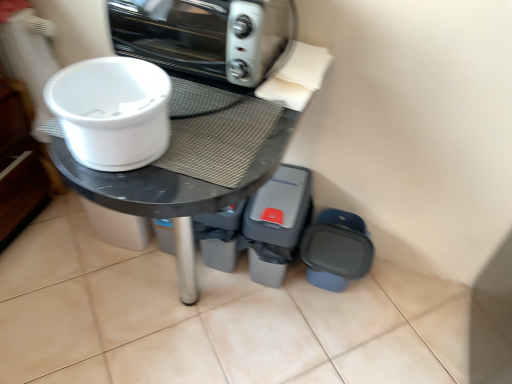
Measure the distance between gray plastic bin at lower right, which appears as the first appliance when viewed from the left, and camera.

gray plastic bin at lower right, which appears as the first appliance when viewed from the left, and camera are 4.07 feet apart.

Identify the location of matte plastic container at lower right, the first appliance from the right. (336, 250).

Where is `gray plastic bin at lower right, the second appliance viewed from the right`? The height and width of the screenshot is (384, 512). gray plastic bin at lower right, the second appliance viewed from the right is located at coordinates (276, 223).

Considering the sizes of objects matte plastic container at lower right, the second appliance viewed from the left, and metallic silver toaster oven at upper center in the image provided, who is shorter, matte plastic container at lower right, the second appliance viewed from the left, or metallic silver toaster oven at upper center?

With less height is metallic silver toaster oven at upper center.

How different are the orientations of matte plastic container at lower right, the first appliance from the right, and metallic silver toaster oven at upper center in degrees?

The angular difference between matte plastic container at lower right, the first appliance from the right, and metallic silver toaster oven at upper center is 2.81 degrees.

Could you tell me if matte plastic container at lower right, the first appliance from the right, is turned towards metallic silver toaster oven at upper center?

No.

The height and width of the screenshot is (384, 512). There is a metallic silver toaster oven at upper center. Identify the location of the 2nd appliance below it (from a real-world perspective). (336, 250).

Is white plastic bowl at upper left oriented away from matte black table at center?

No, matte black table at center is not at the back of white plastic bowl at upper left.

Is there a large distance between white plastic bowl at upper left and matte black table at center?

Actually, white plastic bowl at upper left and matte black table at center are a little close together.

Identify the location of toilet bowl above the matte black table at center (from the image's perspective). This screenshot has height=384, width=512. (112, 112).

From the image's perspective, which is above, white plastic bowl at upper left or matte black table at center?

white plastic bowl at upper left, from the image's perspective.

From a real-world perspective, who is located lower, gray plastic bin at lower right, which appears as the first appliance when viewed from the left, or white plastic bowl at upper left?

gray plastic bin at lower right, which appears as the first appliance when viewed from the left.

Which is in front, point (307, 202) or point (122, 119)?

Positioned in front is point (122, 119).

Can you confirm if gray plastic bin at lower right, the second appliance viewed from the right, is thinner than white plastic bowl at upper left?

No.

You are a GUI agent. You are given a task and a screenshot of the screen. Output one action in this format:
    pyautogui.click(x=<x>, y=<y>)
    Task: Click on the 1st appliance behind the white plastic bowl at upper left, starting your count from the anchor
    
    Given the screenshot: What is the action you would take?
    pyautogui.click(x=276, y=223)

In the scene shown: Is metallic silver toaster oven at upper center beside matte black table at center?

No, metallic silver toaster oven at upper center is not making contact with matte black table at center.

Is point (266, 67) positioned in front of point (69, 181)?

No, (266, 67) is behind (69, 181).

Where is `round table to the left of metallic silver toaster oven at upper center`? Image resolution: width=512 pixels, height=384 pixels. round table to the left of metallic silver toaster oven at upper center is located at coordinates (192, 172).

Is metallic silver toaster oven at upper center positioned with its back to matte black table at center?

No, metallic silver toaster oven at upper center is not facing the opposite direction of matte black table at center.

Does matte black table at center have a smaller size compared to gray plastic bin at lower right, the second appliance viewed from the right?

Incorrect, matte black table at center is not smaller in size than gray plastic bin at lower right, the second appliance viewed from the right.

Which of these two, matte black table at center or gray plastic bin at lower right, which appears as the first appliance when viewed from the left, is wider?

matte black table at center is wider.

Looking at this image, is matte black table at center to the left of gray plastic bin at lower right, which appears as the first appliance when viewed from the left, from the viewer's perspective?

Correct, you'll find matte black table at center to the left of gray plastic bin at lower right, which appears as the first appliance when viewed from the left.

Is gray plastic bin at lower right, the second appliance viewed from the right, with matte plastic container at lower right, the second appliance viewed from the left?

There is a gap between gray plastic bin at lower right, the second appliance viewed from the right, and matte plastic container at lower right, the second appliance viewed from the left.

Based on the photo, measure the distance from gray plastic bin at lower right, the second appliance viewed from the right, to matte plastic container at lower right, the first appliance from the right.

A distance of 6.51 inches exists between gray plastic bin at lower right, the second appliance viewed from the right, and matte plastic container at lower right, the first appliance from the right.

Is gray plastic bin at lower right, which appears as the first appliance when viewed from the left, spatially inside matte plastic container at lower right, the second appliance viewed from the left, or outside of it?

gray plastic bin at lower right, which appears as the first appliance when viewed from the left, lies outside matte plastic container at lower right, the second appliance viewed from the left.

Which is behind, point (295, 199) or point (322, 211)?

The point (322, 211) is behind.

Between matte black table at center and white plastic bowl at upper left, which one has more height?

matte black table at center.

Find the location of a particular element. The width and height of the screenshot is (512, 384). toilet bowl above the matte black table at center (from a real-world perspective) is located at coordinates (112, 112).

Is matte black table at center oriented away from white plastic bowl at upper left?

No.

From the image's perspective, is matte black table at center positioned above or below white plastic bowl at upper left?

Based on their image positions, matte black table at center is located beneath white plastic bowl at upper left.

Find the location of `kitchen appliance above the matte plastic container at lower right, the first appliance from the right (from a real-world perspective)`. kitchen appliance above the matte plastic container at lower right, the first appliance from the right (from a real-world perspective) is located at coordinates (205, 35).

Locate an element on the screen. The height and width of the screenshot is (384, 512). round table below the white plastic bowl at upper left (from the image's perspective) is located at coordinates (192, 172).

Which object lies nearer to the anchor point matte black table at center, white plastic bowl at upper left or gray plastic bin at lower right, which appears as the first appliance when viewed from the left?

white plastic bowl at upper left is closer to matte black table at center.

Considering their positions, is gray plastic bin at lower right, the second appliance viewed from the right, positioned further to white plastic bowl at upper left than matte plastic container at lower right, the first appliance from the right?

Among the two, matte plastic container at lower right, the first appliance from the right, is located further to white plastic bowl at upper left.

Which object lies further to the anchor point gray plastic bin at lower right, which appears as the first appliance when viewed from the left, metallic silver toaster oven at upper center or matte plastic container at lower right, the first appliance from the right?

Based on the image, metallic silver toaster oven at upper center appears to be further to gray plastic bin at lower right, which appears as the first appliance when viewed from the left.

Considering their positions, is matte plastic container at lower right, the second appliance viewed from the left, positioned further to gray plastic bin at lower right, the second appliance viewed from the right, than matte black table at center?

Among the two, matte black table at center is located further to gray plastic bin at lower right, the second appliance viewed from the right.

Based on their spatial positions, is matte black table at center or metallic silver toaster oven at upper center further from gray plastic bin at lower right, the second appliance viewed from the right?

metallic silver toaster oven at upper center.

Looking at the image, which one is located further to metallic silver toaster oven at upper center, gray plastic bin at lower right, which appears as the first appliance when viewed from the left, or matte plastic container at lower right, the first appliance from the right?

Among the two, matte plastic container at lower right, the first appliance from the right, is located further to metallic silver toaster oven at upper center.

Looking at the image, which one is located closer to matte black table at center, gray plastic bin at lower right, which appears as the first appliance when viewed from the left, or matte plastic container at lower right, the first appliance from the right?

Based on the image, gray plastic bin at lower right, which appears as the first appliance when viewed from the left, appears to be nearer to matte black table at center.

Considering their positions, is white plastic bowl at upper left positioned closer to metallic silver toaster oven at upper center than matte plastic container at lower right, the second appliance viewed from the left?

white plastic bowl at upper left lies closer to metallic silver toaster oven at upper center than the other object.

The height and width of the screenshot is (384, 512). In order to click on appliance between metallic silver toaster oven at upper center and matte plastic container at lower right, the first appliance from the right, in the up-down direction in this screenshot , I will do `click(276, 223)`.

Where is `appliance located between white plastic bowl at upper left and matte plastic container at lower right, the second appliance viewed from the left, in the depth direction`? This screenshot has width=512, height=384. appliance located between white plastic bowl at upper left and matte plastic container at lower right, the second appliance viewed from the left, in the depth direction is located at coordinates (276, 223).

Find the location of `round table between metallic silver toaster oven at upper center and gray plastic bin at lower right, the second appliance viewed from the right, in the up-down direction`. round table between metallic silver toaster oven at upper center and gray plastic bin at lower right, the second appliance viewed from the right, in the up-down direction is located at coordinates (192, 172).

Locate an element on the screen. The image size is (512, 384). toilet bowl that lies between metallic silver toaster oven at upper center and matte plastic container at lower right, the first appliance from the right, from top to bottom is located at coordinates (112, 112).